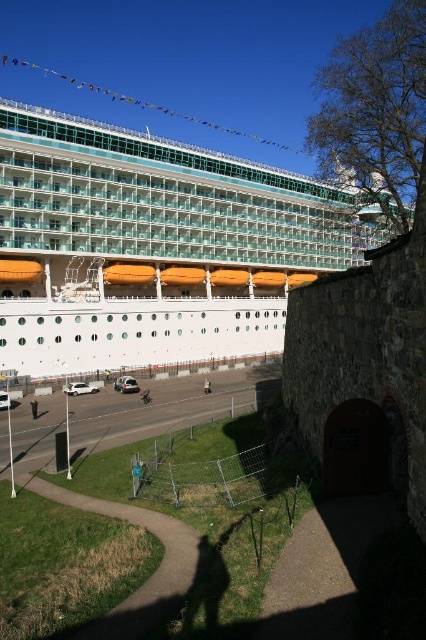
Question: Does light brown leather jacket at lower center lie behind light brown leather jacket at center?

Choices:
 (A) no
 (B) yes

Answer: (A)

Question: Is white glossy cruise ship at upper left behind light brown leather jacket at center?

Choices:
 (A) yes
 (B) no

Answer: (B)

Question: Which point is farther to the camera?

Choices:
 (A) light brown leather jacket at lower center
 (B) white glossy cruise ship at upper left
 (C) light brown leather jacket at center
 (D) green grass at lower left

Answer: (C)

Question: Which point is closer to the camera?

Choices:
 (A) white glossy cruise ship at upper left
 (B) green grass at lower left

Answer: (B)

Question: Considering the relative positions of green grass at lower left and light brown leather jacket at lower center in the image provided, where is green grass at lower left located with respect to light brown leather jacket at lower center?

Choices:
 (A) above
 (B) below

Answer: (B)

Question: Which of these objects is positioned closest to the light brown leather jacket at lower center?

Choices:
 (A) light brown leather jacket at center
 (B) white glossy cruise ship at upper left

Answer: (A)